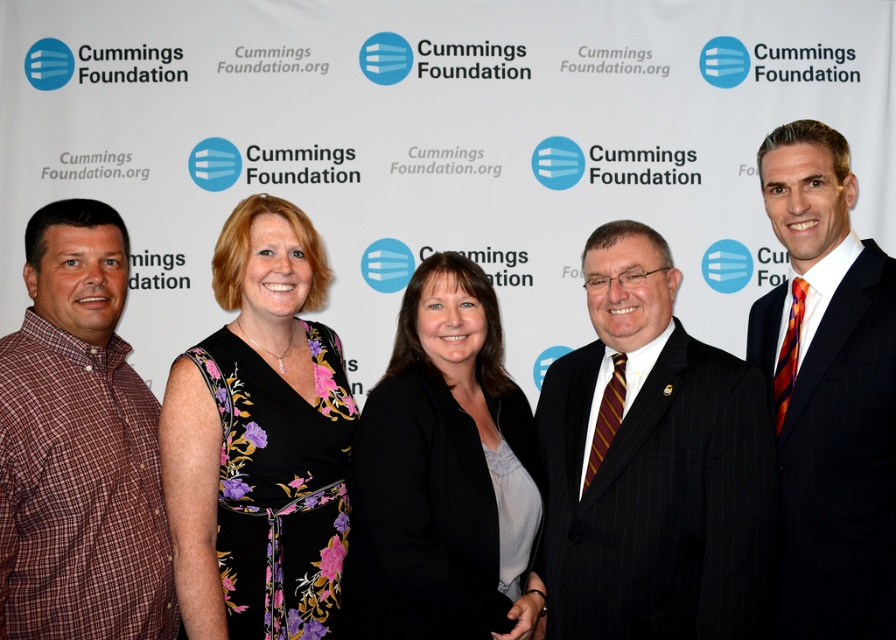
Where is `black pinstripe suit at center`? This screenshot has width=896, height=640. black pinstripe suit at center is located at coordinates (653, 468).

Between point (650, 547) and point (470, 497), which one is positioned behind?

Positioned behind is point (470, 497).

Is point (739, 397) closer to viewer compared to point (343, 628)?

Yes, it is in front of point (343, 628).

At what (x,y) coordinates should I click in order to perform the action: click on black pinstripe suit at center. Please return your answer as a coordinate pair (x, y). This screenshot has width=896, height=640. Looking at the image, I should click on (653, 468).

Is black pinstripe suit at center smaller than black floral dress at center?

No, black pinstripe suit at center is not smaller than black floral dress at center.

Is point (660, 576) positioned in front of point (272, 604)?

Yes, point (660, 576) is in front of point (272, 604).

Measure the distance between black pinstripe suit at center and camera.

The distance of black pinstripe suit at center from camera is 5.65 feet.

Where is `black pinstripe suit at center`? This screenshot has height=640, width=896. black pinstripe suit at center is located at coordinates (653, 468).

Image resolution: width=896 pixels, height=640 pixels. What do you see at coordinates (653, 468) in the screenshot?
I see `black pinstripe suit at center` at bounding box center [653, 468].

Is black pinstripe suit at center shorter than plaid cotton shirt at left?

Yes, black pinstripe suit at center is shorter than plaid cotton shirt at left.

Locate an element on the screen. black pinstripe suit at center is located at coordinates (653, 468).

The image size is (896, 640). What are the coordinates of `black pinstripe suit at center` in the screenshot? It's located at (653, 468).